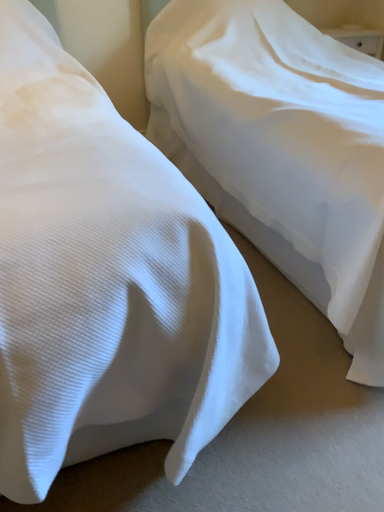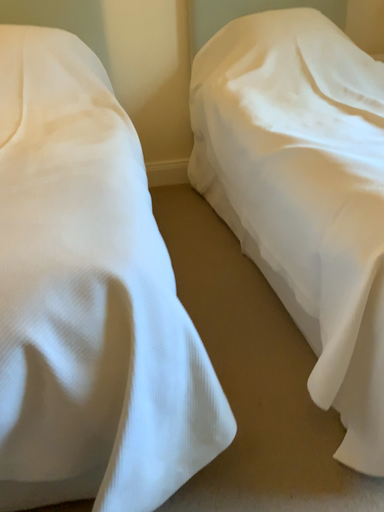
Question: Which way did the camera rotate in the video?

Choices:
 (A) rotated right
 (B) rotated left

Answer: (B)